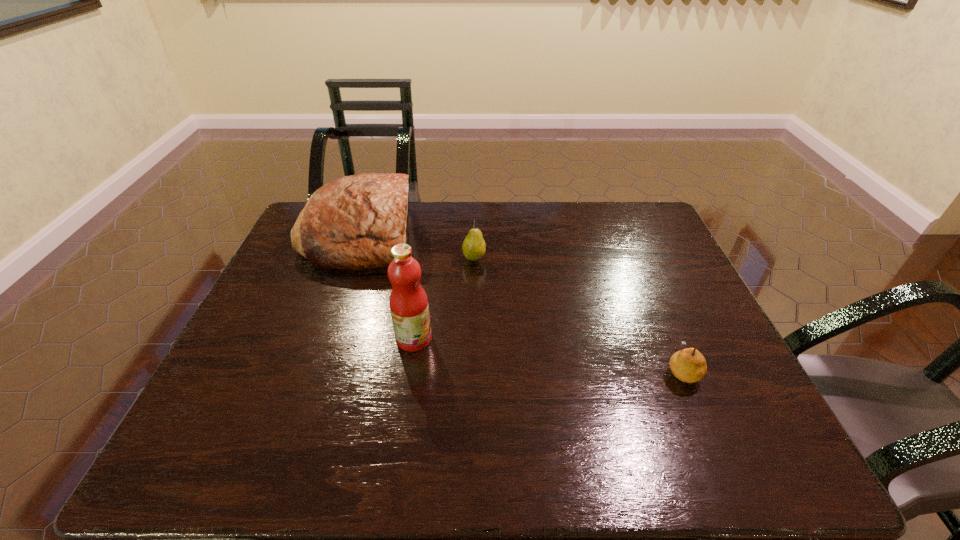
You are a GUI agent. You are given a task and a screenshot of the screen. Output one action in this format:
    pyautogui.click(x=<x>, y=<y>)
    Task: Click on the free space between the bread and the tallest object
    
    Given the screenshot: What is the action you would take?
    pyautogui.click(x=387, y=287)

Locate an element on the screen. empty space between the nearer pear and the third shortest object is located at coordinates (520, 302).

Locate which object ranks third in proximity to the leftmost object. Please provide its 2D coordinates. Your answer should be formatted as a tuple, i.e. [(x, y)], where the tuple contains the x and y coordinates of a point satisfying the conditions above.

[(688, 365)]

Find the location of `the third closest object relative to the farther pear`. the third closest object relative to the farther pear is located at coordinates click(688, 365).

This screenshot has height=540, width=960. In order to click on vacant area in the image that satisfies the following two spatial constraints: 1. at the sliced front of the bread; 2. on the right side of the nearer pear in this screenshot , I will do `click(313, 370)`.

This screenshot has height=540, width=960. I want to click on vacant space that satisfies the following two spatial constraints: 1. on the front label of the fruit juice; 2. on the right side of the shorter pear, so click(x=409, y=370).

The height and width of the screenshot is (540, 960). In order to click on vacant space that satisfies the following two spatial constraints: 1. on the back side of the second object from right to left; 2. at the sliced front of the bread in this screenshot , I will do `click(474, 234)`.

The width and height of the screenshot is (960, 540). In order to click on vacant point that satisfies the following two spatial constraints: 1. at the sliced front of the nearer pear; 2. on the left side of the leftmost object in this screenshot , I will do `click(313, 370)`.

Where is `vacant space that satisfies the following two spatial constraints: 1. at the sliced front of the bread; 2. on the back side of the shortest object`? Image resolution: width=960 pixels, height=540 pixels. vacant space that satisfies the following two spatial constraints: 1. at the sliced front of the bread; 2. on the back side of the shortest object is located at coordinates (313, 370).

You are a GUI agent. You are given a task and a screenshot of the screen. Output one action in this format:
    pyautogui.click(x=<x>, y=<y>)
    Task: Click on the vacant space that satisfies the following two spatial constraints: 1. at the sliced front of the third tallest object; 2. on the right side of the leftmost object
    The width and height of the screenshot is (960, 540).
    Given the screenshot: What is the action you would take?
    pyautogui.click(x=351, y=258)